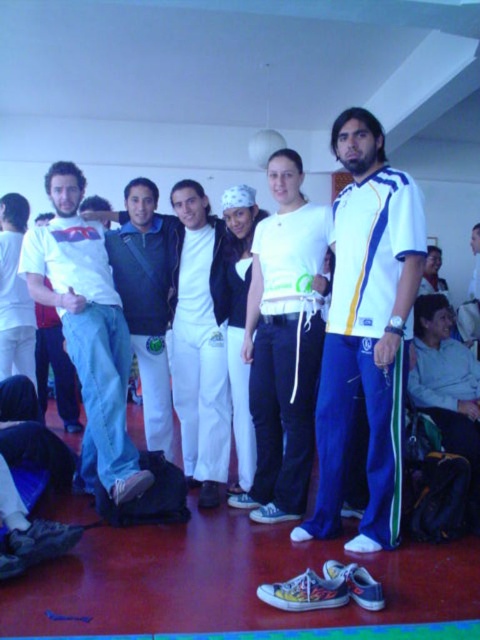
Which of these two, white jersey at center or white cotton t-shirt at left, stands shorter?

With less height is white cotton t-shirt at left.

Between white jersey at center and white cotton t-shirt at left, which one is positioned lower?

white cotton t-shirt at left is lower down.

This screenshot has height=640, width=480. What do you see at coordinates (367, 332) in the screenshot?
I see `white jersey at center` at bounding box center [367, 332].

This screenshot has width=480, height=640. Find the location of `white jersey at center`. white jersey at center is located at coordinates (367, 332).